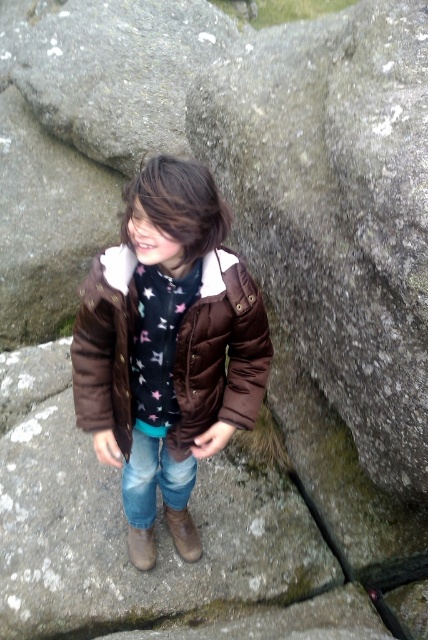
Question: Is brown matte jacket at center to the right of brown suede boot at lower center from the viewer's perspective?

Choices:
 (A) no
 (B) yes

Answer: (B)

Question: Does gray rough rock at center have a larger size compared to brown suede boot at lower center?

Choices:
 (A) no
 (B) yes

Answer: (B)

Question: Can you confirm if brown puffy jacket at center is positioned above brown leather boot at lower center?

Choices:
 (A) no
 (B) yes

Answer: (B)

Question: Which object is positioned closest to the brown leather boot at lower center?

Choices:
 (A) brown matte jacket at center
 (B) brown suede boot at lower center
 (C) gray rough rock at center

Answer: (B)

Question: Which of these objects is positioned farthest from the brown suede boot at lower center?

Choices:
 (A) brown matte jacket at center
 (B) brown puffy jacket at center
 (C) gray rough rock at center

Answer: (C)

Question: Which point appears farthest from the camera in this image?

Choices:
 (A) (116, 385)
 (B) (190, 204)

Answer: (A)